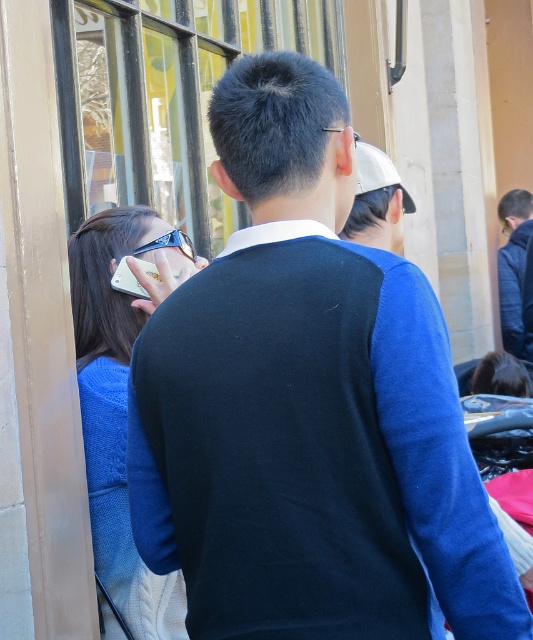
You are standing in front of the building and notice the person wearing the satin blue sweater at left. Can you determine if the sweater is positioned to the left or right of the large windows?

The satin blue sweater at left is located at point (x=118, y=404), which places it to the left side of the large windows.

You are standing in front of a building with large windows. You see a person wearing a satin blue sweater at left and holding a white matte phone at upper center. Which object is nearer to you?

The satin blue sweater at left is closer to the viewer than the white matte phone at upper center.